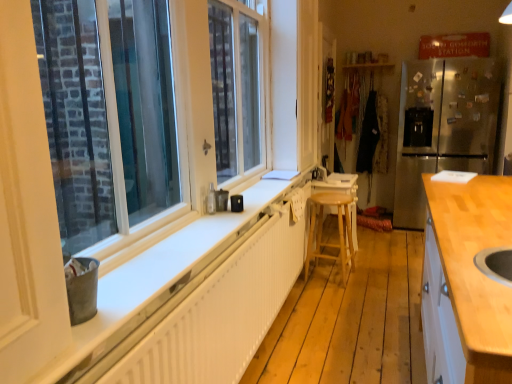
This screenshot has width=512, height=384. What are the coordinates of `blank area beneath light brown wooden stool at center (from a real-world perspective)` in the screenshot? It's located at (326, 280).